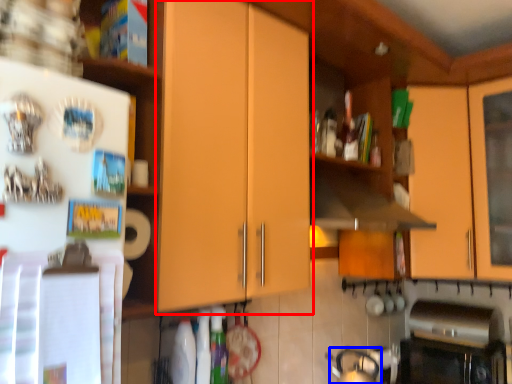
Question: Which object appears farthest to the camera in this image, cabinetry (highlighted by a red box) or tea pot (highlighted by a blue box)?

Choices:
 (A) cabinetry
 (B) tea pot

Answer: (B)